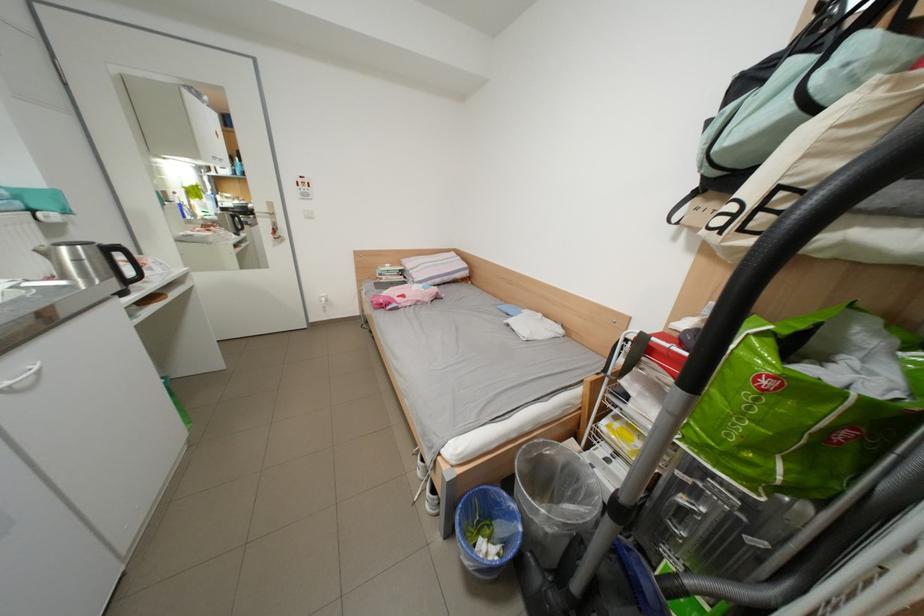
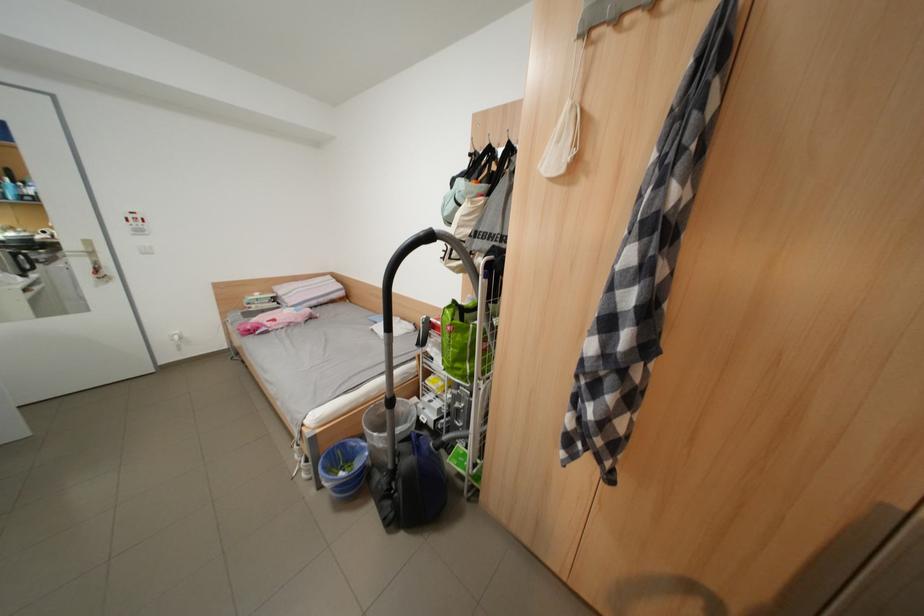
The point at (518, 326) is marked in the first image. Where is the corresponding point in the second image?

(383, 331)